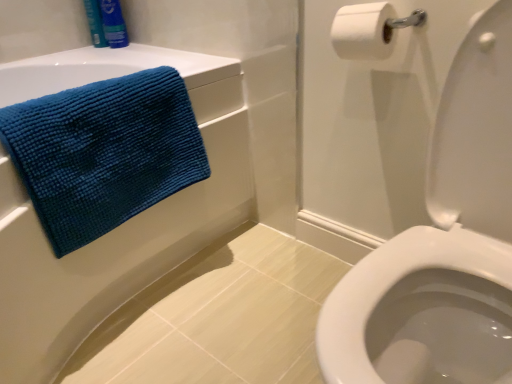
Question: Is white glossy toilet seat at right wider than blue fabric shampoo at upper left, the 1th toiletry in the right-to-left sequence?

Choices:
 (A) no
 (B) yes

Answer: (B)

Question: Considering the relative positions of white glossy toilet seat at right and blue fabric shampoo at upper left, the 1th toiletry in the right-to-left sequence, in the image provided, is white glossy toilet seat at right to the right of blue fabric shampoo at upper left, the 1th toiletry in the right-to-left sequence, from the viewer's perspective?

Choices:
 (A) yes
 (B) no

Answer: (A)

Question: From the image's perspective, is white glossy toilet seat at right on blue fabric shampoo at upper left, the 1th toiletry in the right-to-left sequence?

Choices:
 (A) no
 (B) yes

Answer: (A)

Question: Is white glossy toilet seat at right taller than blue fabric shampoo at upper left, positioned as the second toiletry in left-to-right order?

Choices:
 (A) no
 (B) yes

Answer: (B)

Question: Does white glossy toilet seat at right have a lesser width compared to blue fabric shampoo at upper left, the 1th toiletry in the right-to-left sequence?

Choices:
 (A) yes
 (B) no

Answer: (B)

Question: Is white glossy toilet seat at right completely or partially outside of blue fabric shampoo at upper left, the 1th toiletry in the right-to-left sequence?

Choices:
 (A) yes
 (B) no

Answer: (A)

Question: Can white glossy toilet seat at right be found inside white matte toilet paper at upper right?

Choices:
 (A) no
 (B) yes

Answer: (A)

Question: Can you confirm if white matte toilet paper at upper right is shorter than white glossy toilet seat at right?

Choices:
 (A) yes
 (B) no

Answer: (A)

Question: Is white matte toilet paper at upper right facing away from white glossy toilet seat at right?

Choices:
 (A) no
 (B) yes

Answer: (A)

Question: From the image's perspective, is white matte toilet paper at upper right over white glossy toilet seat at right?

Choices:
 (A) no
 (B) yes

Answer: (B)

Question: From a real-world perspective, is white matte toilet paper at upper right located higher than white glossy toilet seat at right?

Choices:
 (A) no
 (B) yes

Answer: (B)

Question: Is white matte toilet paper at upper right not near white glossy toilet seat at right?

Choices:
 (A) no
 (B) yes

Answer: (A)

Question: Is blue fabric shampoo at upper left, positioned as the second toiletry in left-to-right order, looking in the opposite direction of blue textured towel at upper left?

Choices:
 (A) yes
 (B) no

Answer: (B)